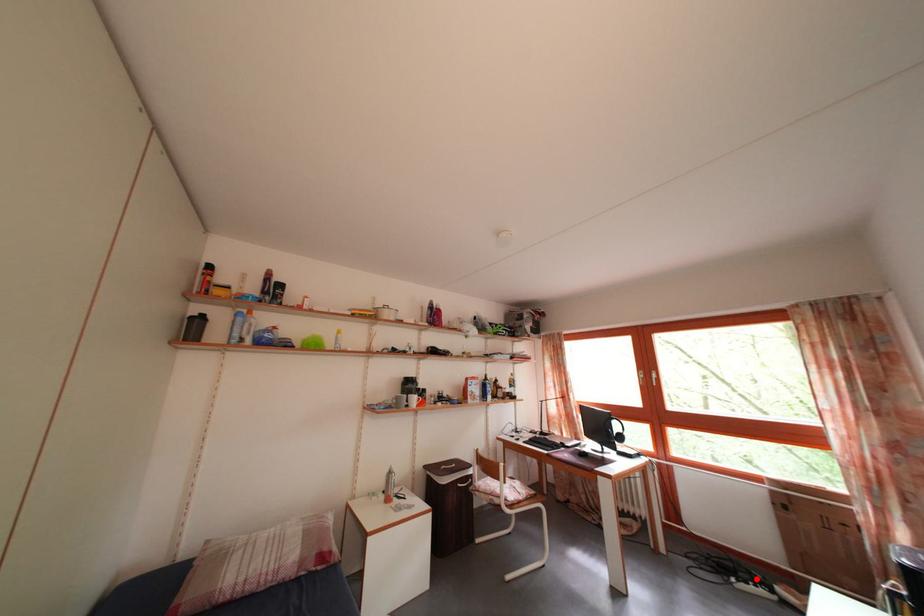
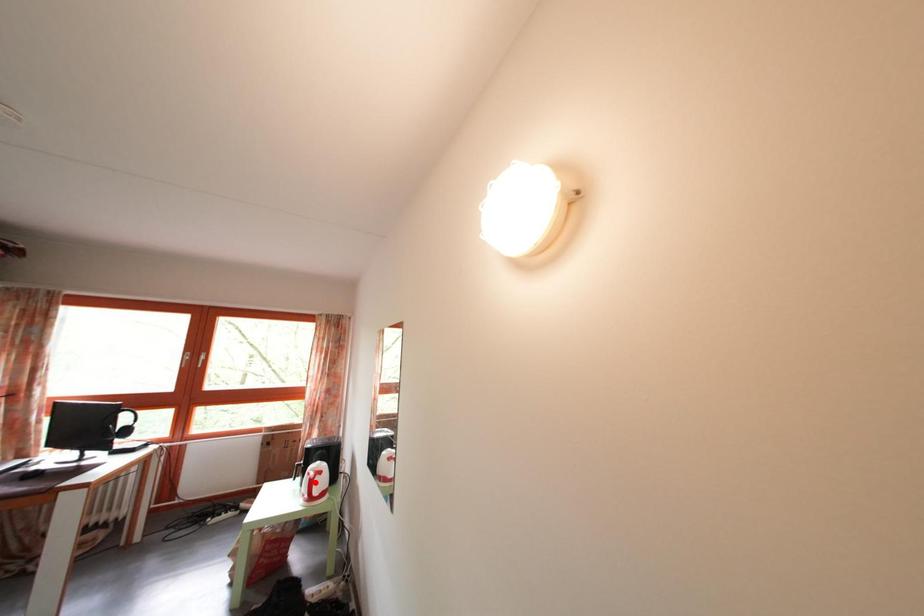
I am providing you with two images of the same scene from different viewpoints. A red point is marked on the first image and another point is marked on the second image. Does the point marked in image1 correspond to the same location as the one in image2?

No